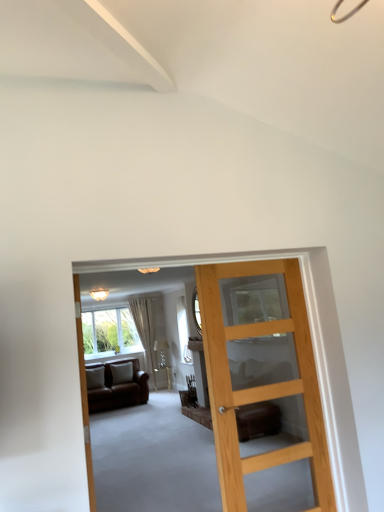
The image size is (384, 512). Describe the element at coordinates (261, 385) in the screenshot. I see `light brown wooden door at center` at that location.

This screenshot has height=512, width=384. Identify the location of light brown wooden door at center. (261, 385).

Locate an element on the screen. The height and width of the screenshot is (512, 384). light brown wooden door at center is located at coordinates 261,385.